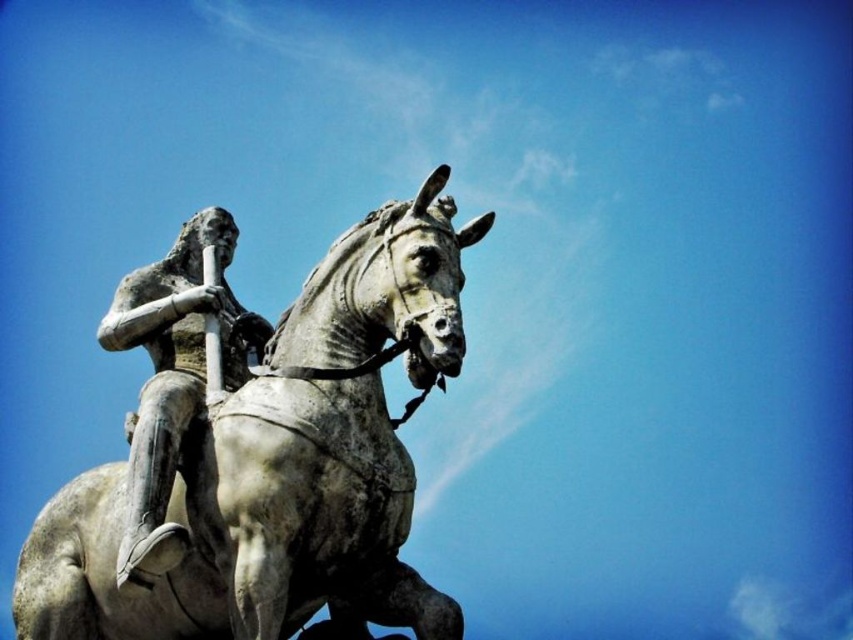
Question: Can you confirm if gray stone horse at center is positioned below bronze statue at center?

Choices:
 (A) no
 (B) yes

Answer: (B)

Question: Which point is closer to the camera?

Choices:
 (A) bronze statue at center
 (B) gray stone horse at center

Answer: (A)

Question: Does gray stone horse at center appear under bronze statue at center?

Choices:
 (A) yes
 (B) no

Answer: (A)

Question: Among these objects, which one is farthest from the camera?

Choices:
 (A) bronze statue at center
 (B) gray stone horse at center

Answer: (B)

Question: Can you confirm if gray stone horse at center is positioned to the left of bronze statue at center?

Choices:
 (A) yes
 (B) no

Answer: (B)